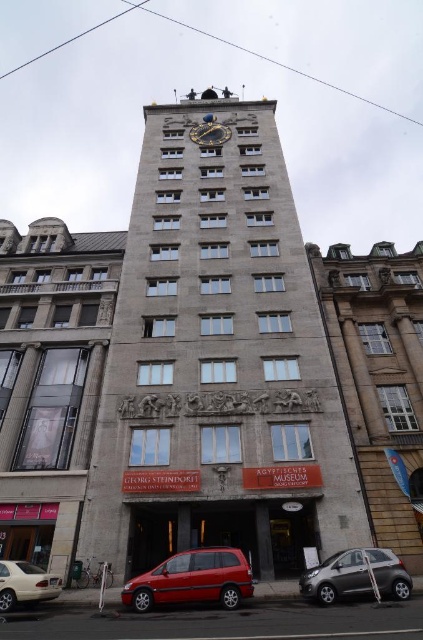
In the scene shown: Can you confirm if metallic gray hatchback at lower right is smaller than matte silver sedan at lower left?

Actually, metallic gray hatchback at lower right might be larger than matte silver sedan at lower left.

Measure the distance between metallic gray hatchback at lower right and camera.

57.08 feet

The width and height of the screenshot is (423, 640). I want to click on metallic gray hatchback at lower right, so (335, 577).

Between gray stone clock tower at center and matte silver sedan at lower left, which one appears on the left side from the viewer's perspective?

Positioned to the left is matte silver sedan at lower left.

What do you see at coordinates (216, 362) in the screenshot? This screenshot has height=640, width=423. I see `gray stone clock tower at center` at bounding box center [216, 362].

I want to click on gray stone clock tower at center, so click(216, 362).

Can you confirm if matte stone building at left is positioned above goldmetallicclock at upper center?

No.

Is point (90, 445) positioned before point (225, 131)?

Yes, it is in front of point (225, 131).

Where is `matte stone building at left`? This screenshot has height=640, width=423. matte stone building at left is located at coordinates (51, 380).